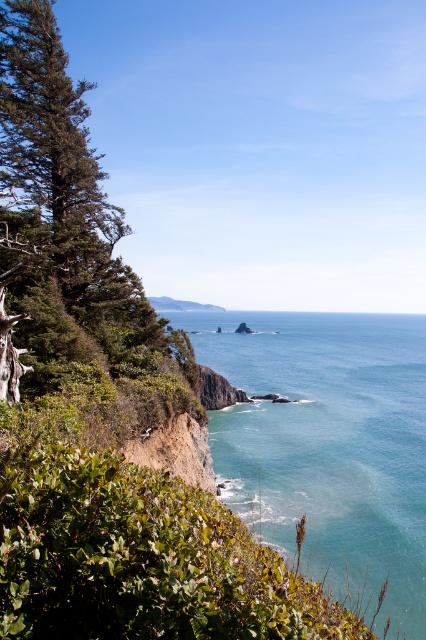
You are standing on the cliff and want to compare the sizes of the clear blue water at center and the green leafy tree at left. Which one is wider from your viewpoint?

The clear blue water at center is wider than the green leafy tree at left according to the description.

You are standing on the cliff and want to determine which object is taller between the clear blue water at center and the green leafy tree at left. Based on the scene, which one is taller?

The green leafy tree at left is taller than the clear blue water at center.